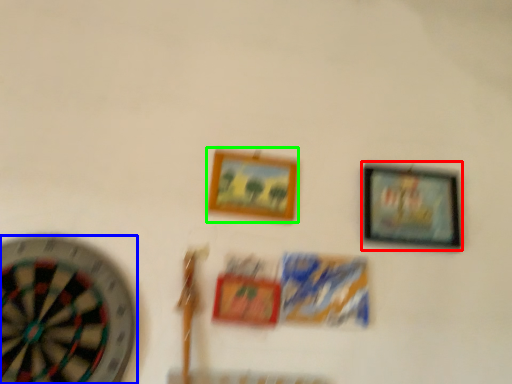
Question: Which object is positioned closest to picture frame (highlighted by a red box)? Select from wheel (highlighted by a blue box) and picture frame (highlighted by a green box).

Choices:
 (A) wheel
 (B) picture frame

Answer: (B)